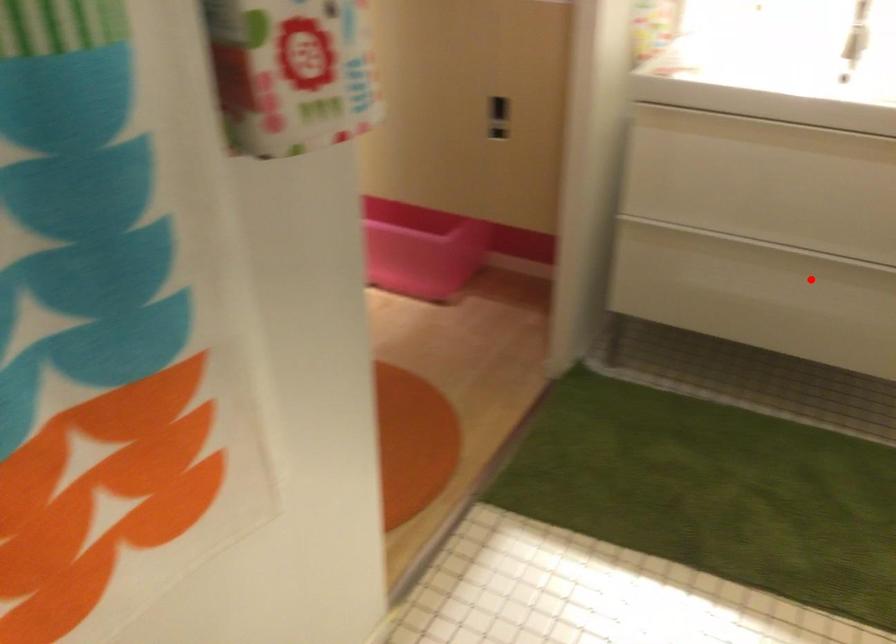
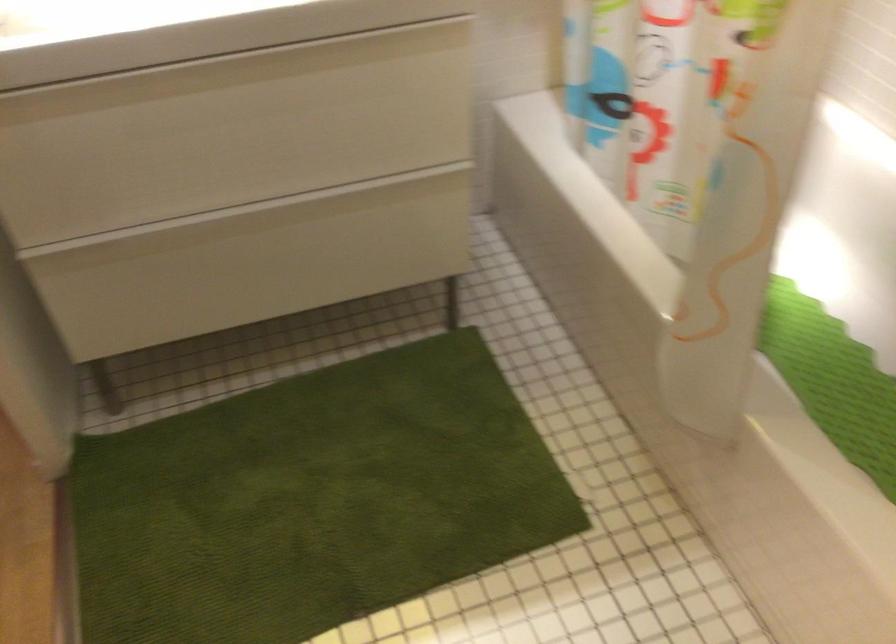
Find the pixel in the second image that matches the highlighted location in the first image.

(289, 238)